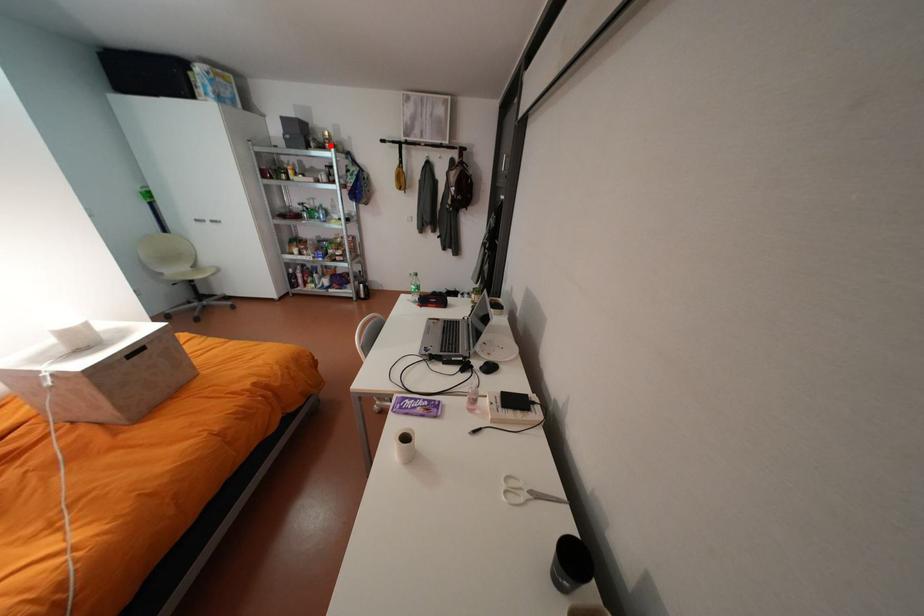
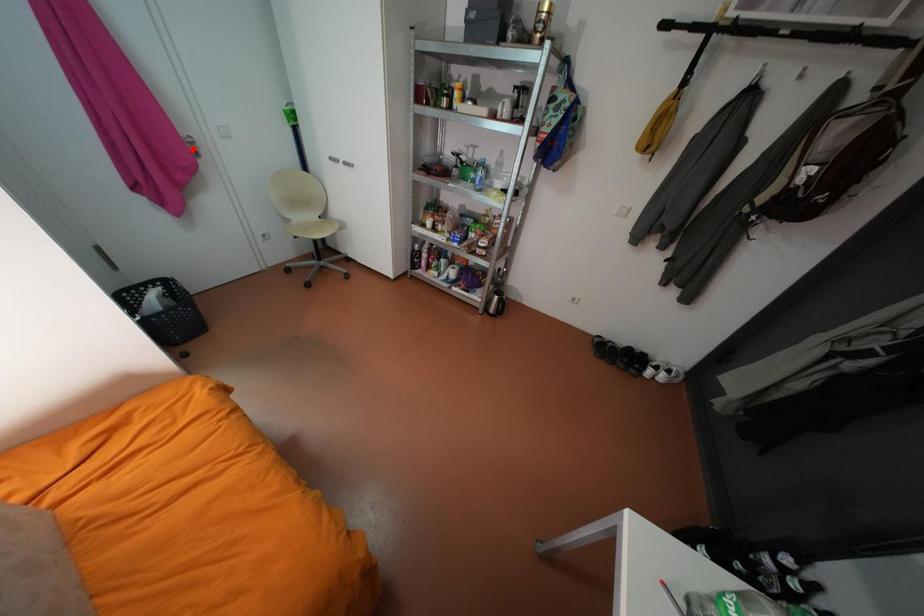
I am providing you with two images of the same scene from different viewpoints. A red point is marked on the first image and another point is marked on the second image. Do the highlighted points in image1 and image2 indicate the same real-world spot?

No